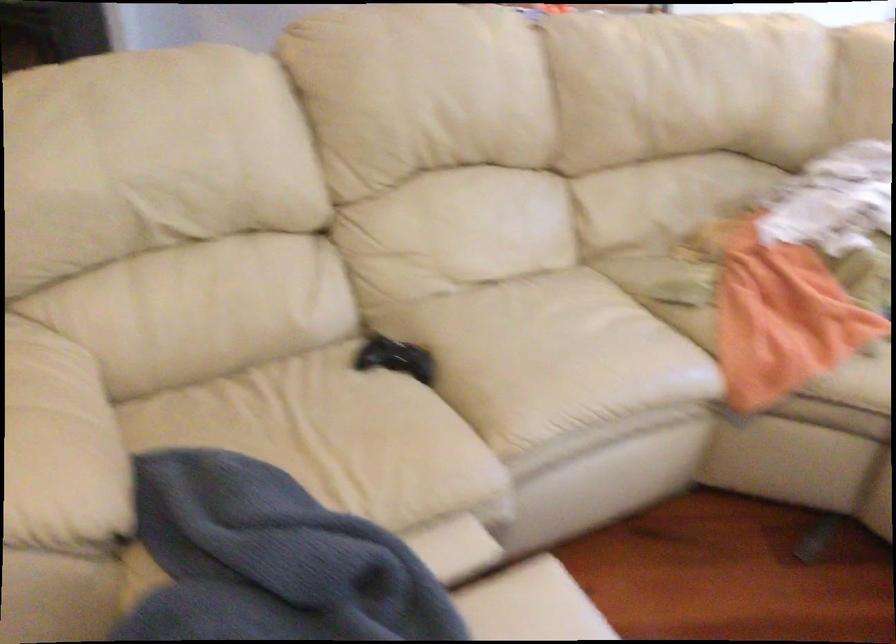
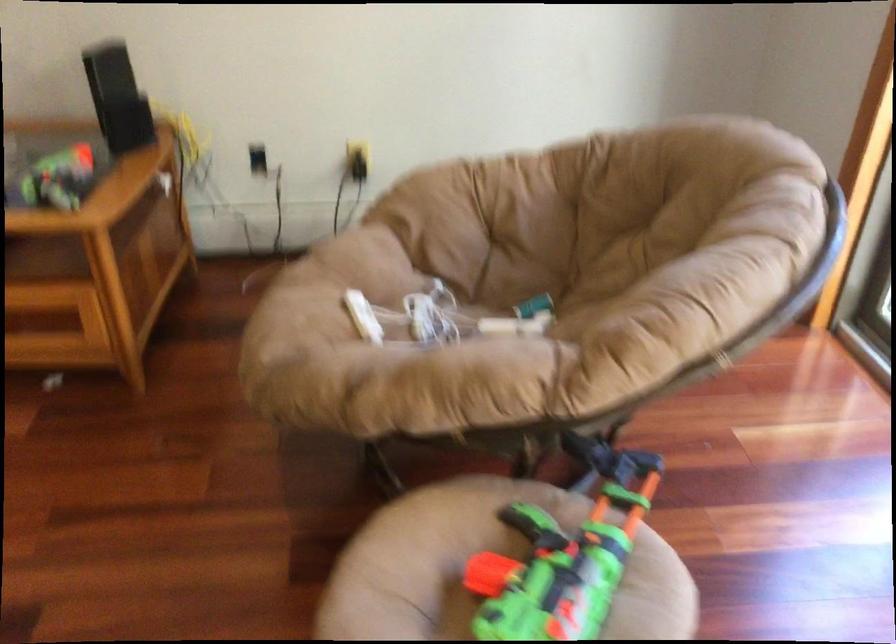
In a continuous first-person perspective shot, in which direction is the camera moving?

The cameraman moved toward right, forward.